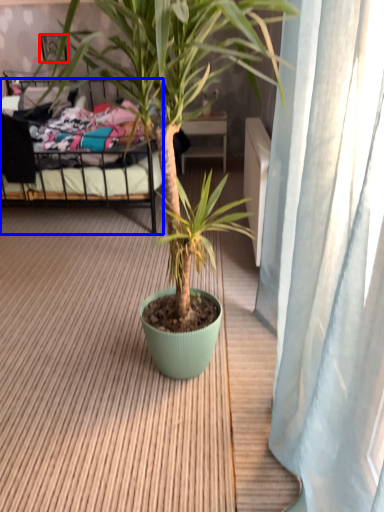
Question: Which object is closer to the camera taking this photo, picture frame (highlighted by a red box) or bed (highlighted by a blue box)?

Choices:
 (A) picture frame
 (B) bed

Answer: (B)